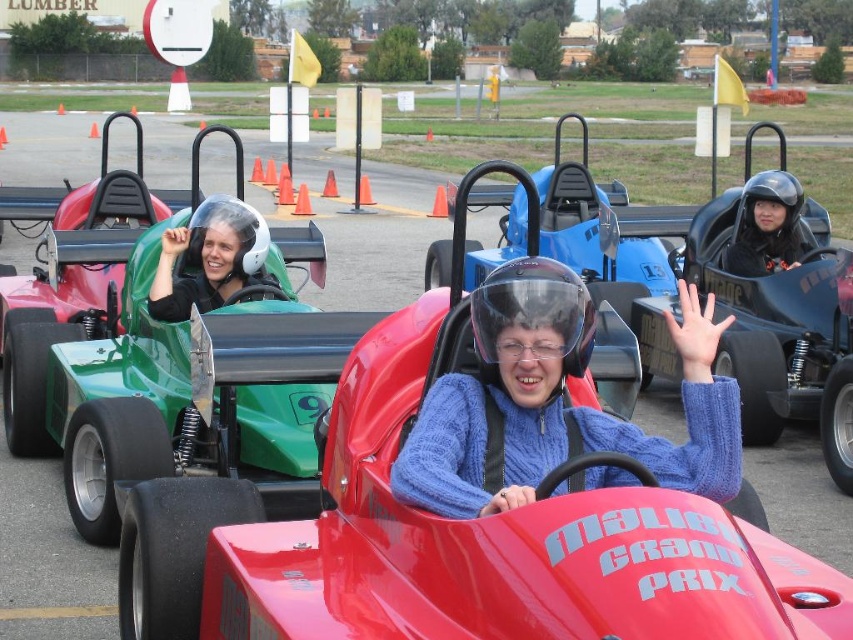
You are a photographer standing at the starting line of the go kart track. You want to take a photo that includes both the point at [439,442] and the point at [756,221]. Which point will appear larger in the photo?

Point at [439,442] will appear larger in the photo because it is closer to the camera than point at [756,221].

Looking at this image, you are a photographer standing at the edge of the go kart track. You want to take a photo of the blue knitted sweater at center and the black helmet at center. Which object is positioned closer to the camera?

The blue knitted sweater at center is closer to the viewer than the black helmet at center, so the blue knitted sweater at center would appear closer to the camera in the photo.